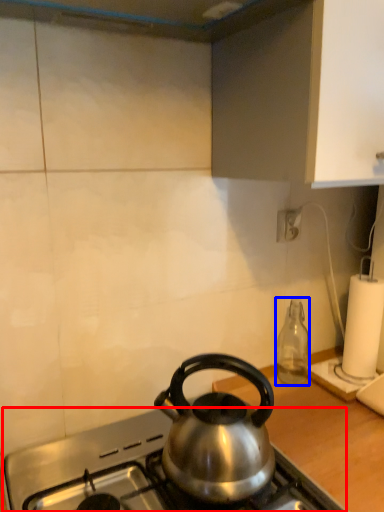
Question: Which of the following is the closest to the observer, gas stove (highlighted by a red box) or bottle (highlighted by a blue box)?

Choices:
 (A) gas stove
 (B) bottle

Answer: (A)